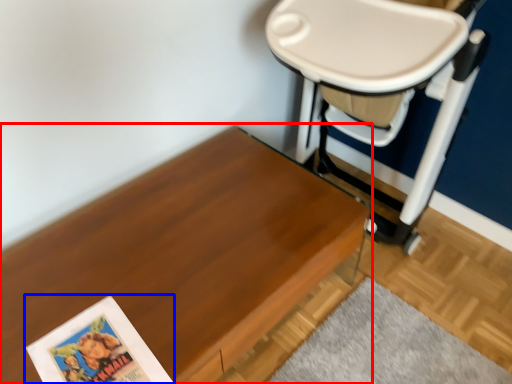
Question: Which of the following is the farthest to the observer, table (highlighted by a red box) or paperback book (highlighted by a blue box)?

Choices:
 (A) table
 (B) paperback book

Answer: (B)